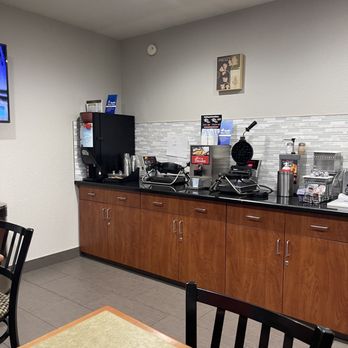
Where is `table`? The width and height of the screenshot is (348, 348). table is located at coordinates (102, 326).